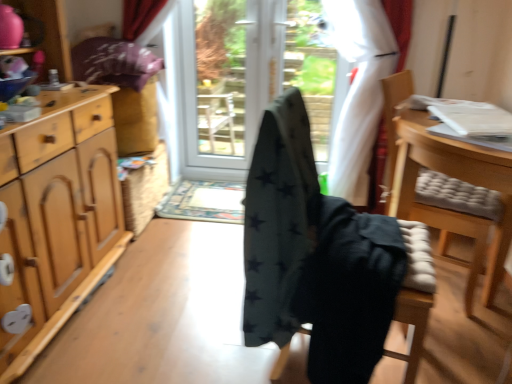
Find the location of a particular element. free space to the left of dark gray fabric chair at center, which is counted as the third chair, starting from the right is located at coordinates (198, 332).